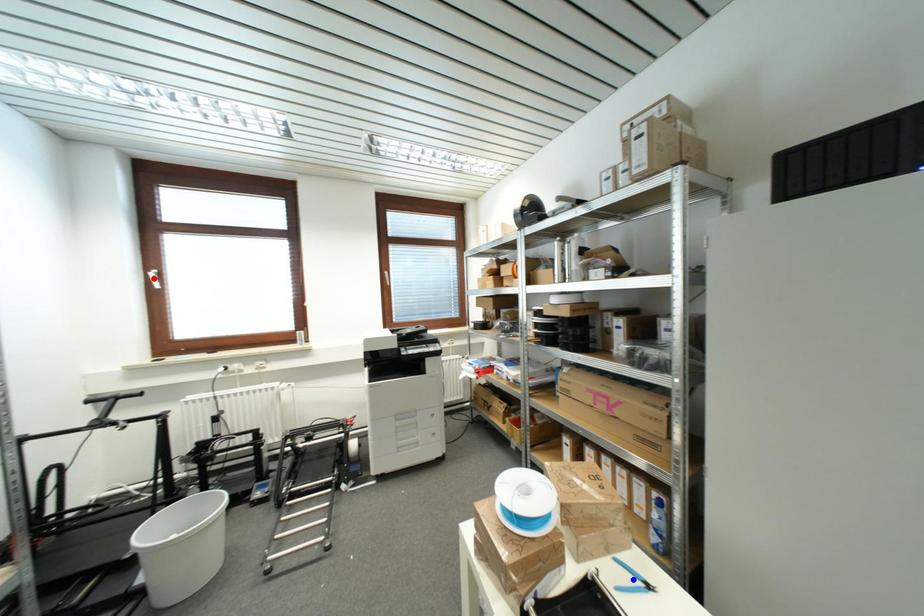
Question: In the image, two points are highlighted. Which point is nearer to the camera? Reply with the corresponding letter.

Choices:
 (A) blue point
 (B) red point

Answer: (A)